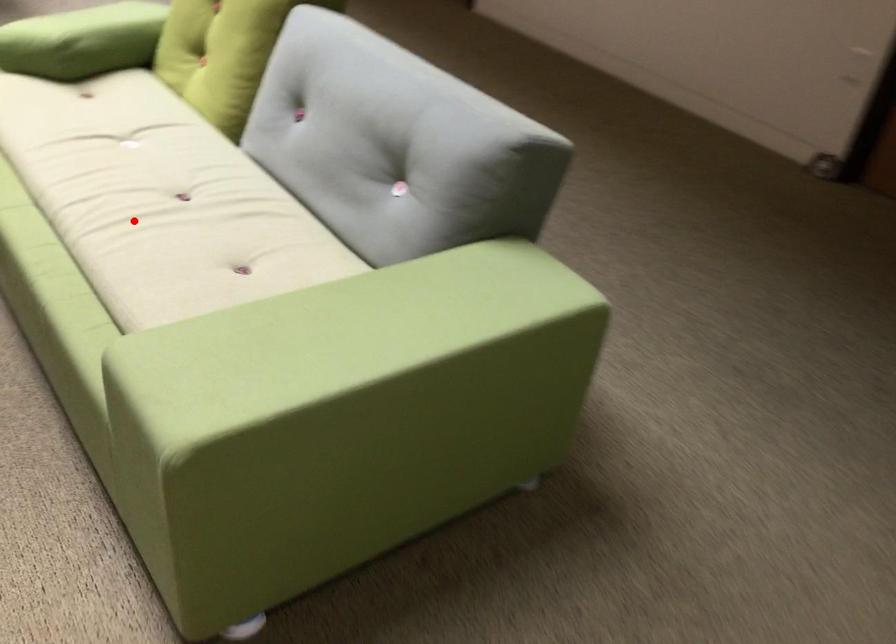
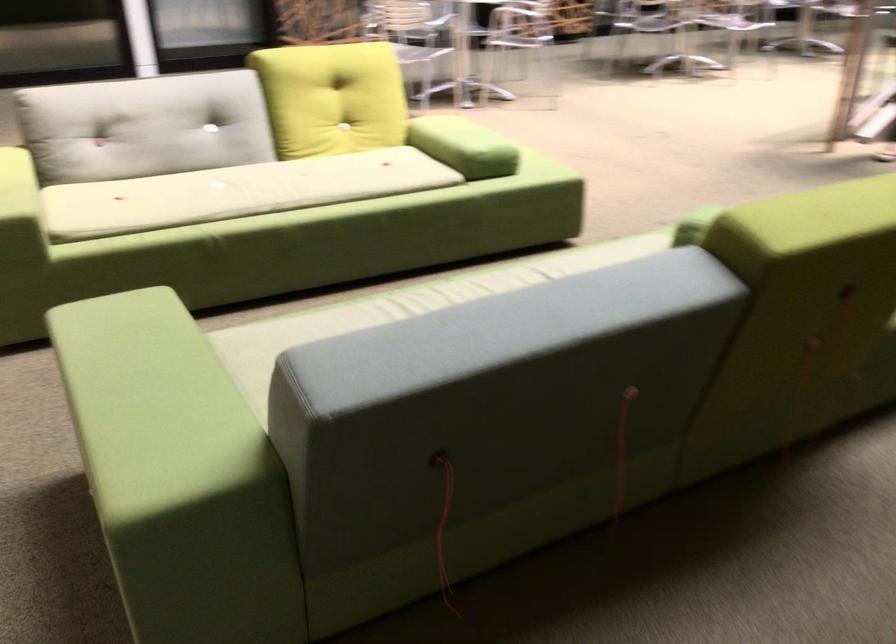
Question: I am providing you with two images of the same scene from different viewpoints. A red point is shown in image1. For the corresponding object point in image2, is it positioned nearer or farther from the camera?

Choices:
 (A) Nearer
 (B) Farther

Answer: (B)